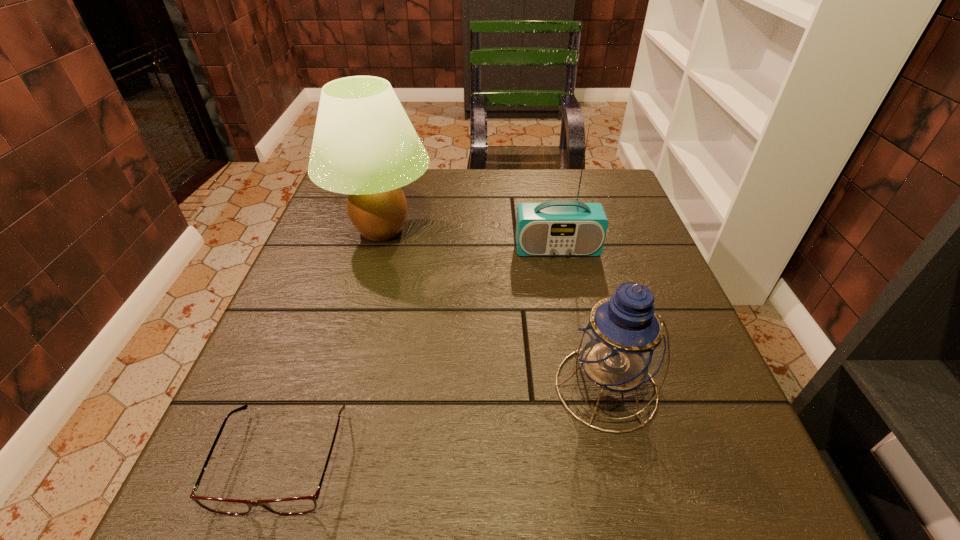
Identify the location of free space that is in between the third shortest object and the spectacles. This screenshot has width=960, height=540. (420, 354).

The height and width of the screenshot is (540, 960). I want to click on vacant area that lies between the spectacles and the radio receiver, so click(x=420, y=354).

Locate an element on the screen. free space between the spectacles and the third tallest object is located at coordinates (444, 423).

Identify the location of free area in between the second shortest object and the radio receiver. The width and height of the screenshot is (960, 540). (582, 318).

At what (x,y) coordinates should I click in order to perform the action: click on vacant area that lies between the radio receiver and the lampshade. Please return your answer as a coordinate pair (x, y). The height and width of the screenshot is (540, 960). Looking at the image, I should click on (469, 239).

Where is `free area in between the shortest object and the lantern`? The width and height of the screenshot is (960, 540). free area in between the shortest object and the lantern is located at coordinates (444, 423).

Identify the location of free space between the third tallest object and the third shortest object. (582, 318).

Locate an element on the screen. Image resolution: width=960 pixels, height=540 pixels. free area in between the spectacles and the radio receiver is located at coordinates (420, 354).

Find the location of a particular element. The image size is (960, 540). free spot between the second shortest object and the shortest object is located at coordinates (444, 423).

The image size is (960, 540). I want to click on free space between the third tallest object and the radio receiver, so click(582, 318).